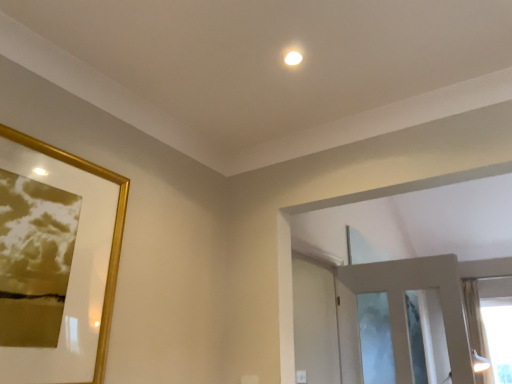
Question: Would you say sheer fabric curtain at right is outside gold glossy picture frame at upper left?

Choices:
 (A) yes
 (B) no

Answer: (A)

Question: Considering the relative positions of sheer fabric curtain at right and gold glossy picture frame at upper left in the image provided, is sheer fabric curtain at right to the right of gold glossy picture frame at upper left from the viewer's perspective?

Choices:
 (A) yes
 (B) no

Answer: (A)

Question: Does sheer fabric curtain at right have a larger size compared to gold glossy picture frame at upper left?

Choices:
 (A) yes
 (B) no

Answer: (A)

Question: Considering the relative positions of sheer fabric curtain at right and gold glossy picture frame at upper left in the image provided, is sheer fabric curtain at right to the left of gold glossy picture frame at upper left from the viewer's perspective?

Choices:
 (A) yes
 (B) no

Answer: (B)

Question: Is there a large distance between sheer fabric curtain at right and gold glossy picture frame at upper left?

Choices:
 (A) yes
 (B) no

Answer: (A)

Question: Would you say white glossy screen door at center is inside or outside sheer fabric curtain at right?

Choices:
 (A) inside
 (B) outside

Answer: (B)

Question: In the image, is white glossy screen door at center positioned in front of or behind sheer fabric curtain at right?

Choices:
 (A) behind
 (B) front

Answer: (B)

Question: Considering the relative positions of white glossy screen door at center and sheer fabric curtain at right in the image provided, is white glossy screen door at center to the left or to the right of sheer fabric curtain at right?

Choices:
 (A) left
 (B) right

Answer: (A)

Question: Considering the positions of white glossy screen door at center and sheer fabric curtain at right in the image, is white glossy screen door at center taller or shorter than sheer fabric curtain at right?

Choices:
 (A) short
 (B) tall

Answer: (A)

Question: Visually, is white glossy screen door at center positioned to the left or to the right of gold glossy picture frame at upper left?

Choices:
 (A) right
 (B) left

Answer: (A)

Question: Based on their sizes in the image, would you say white glossy screen door at center is bigger or smaller than gold glossy picture frame at upper left?

Choices:
 (A) big
 (B) small

Answer: (A)

Question: Choose the correct answer: Is white glossy screen door at center inside gold glossy picture frame at upper left or outside it?

Choices:
 (A) inside
 (B) outside

Answer: (B)

Question: From the image's perspective, is white glossy screen door at center located above or below gold glossy picture frame at upper left?

Choices:
 (A) above
 (B) below

Answer: (B)

Question: Is gold glossy picture frame at upper left in front of or behind sheer fabric curtain at right in the image?

Choices:
 (A) behind
 (B) front

Answer: (B)

Question: Looking at the image, does gold glossy picture frame at upper left seem bigger or smaller compared to sheer fabric curtain at right?

Choices:
 (A) small
 (B) big

Answer: (A)